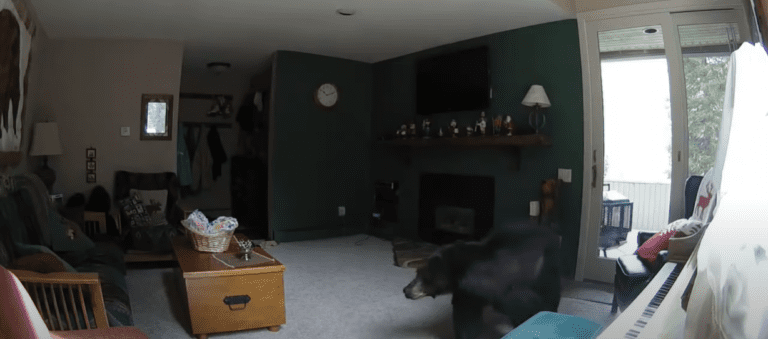
The height and width of the screenshot is (339, 768). In order to click on left armrest of couch in this screenshot , I will do `click(91, 215)`.